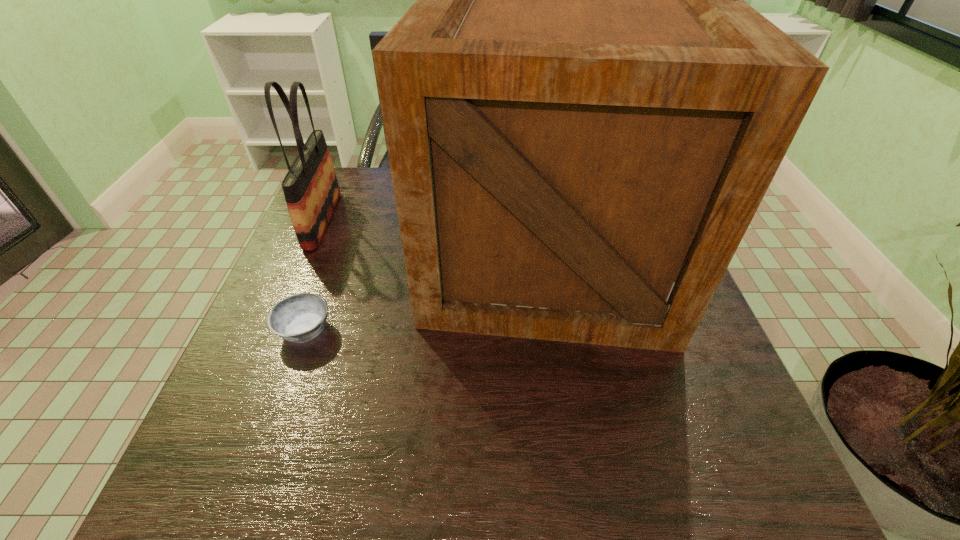
Identify the location of vacant area that satisfies the following two spatial constraints: 1. on the back side of the ashtray; 2. on the left side of the rightmost object. The width and height of the screenshot is (960, 540). (333, 253).

Identify the location of vacant space that satisfies the following two spatial constraints: 1. on the front-facing side of the second tallest object; 2. on the back side of the shortest object. The image size is (960, 540). click(x=276, y=330).

Identify the location of vacant area in the image that satisfies the following two spatial constraints: 1. on the front-facing side of the second tallest object; 2. on the back side of the shortest object. This screenshot has height=540, width=960. (276, 330).

The height and width of the screenshot is (540, 960). I want to click on vacant space that satisfies the following two spatial constraints: 1. on the front-facing side of the second shortest object; 2. on the left side of the ashtray, so click(x=276, y=330).

Locate an element on the screen. The width and height of the screenshot is (960, 540). vacant area in the image that satisfies the following two spatial constraints: 1. on the back side of the ashtray; 2. on the front-facing side of the shopping bag is located at coordinates (345, 220).